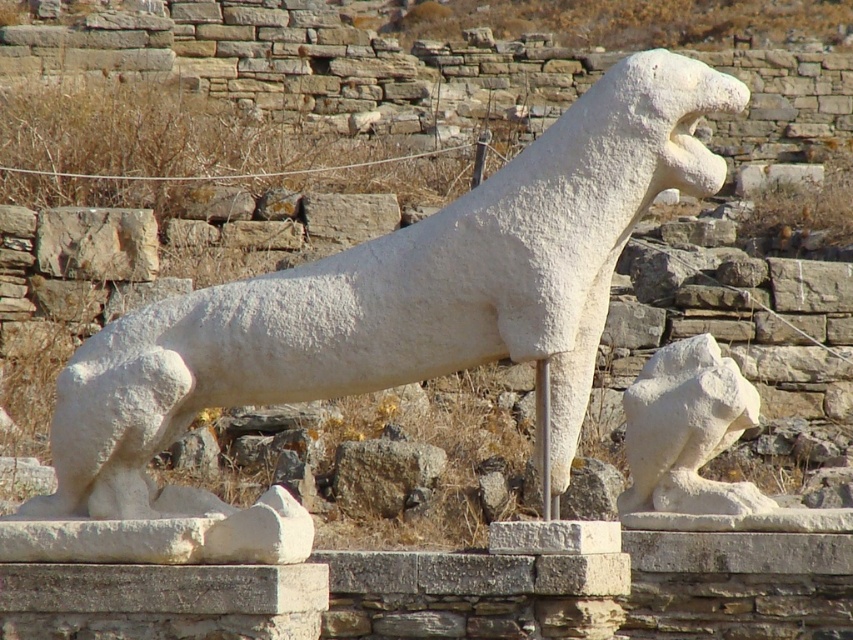
Question: Can you confirm if white marble dog at center is smaller than white stone lion at lower right?

Choices:
 (A) no
 (B) yes

Answer: (A)

Question: Which object is farther from the camera taking this photo?

Choices:
 (A) white marble dog at center
 (B) white stone lion at lower right

Answer: (B)

Question: Can you confirm if white marble dog at center is positioned above white stone lion at lower right?

Choices:
 (A) yes
 (B) no

Answer: (A)

Question: Does white marble dog at center have a smaller size compared to white stone lion at lower right?

Choices:
 (A) no
 (B) yes

Answer: (A)

Question: Which point appears closest to the camera in this image?

Choices:
 (A) [x=260, y=332]
 (B) [x=737, y=397]

Answer: (A)